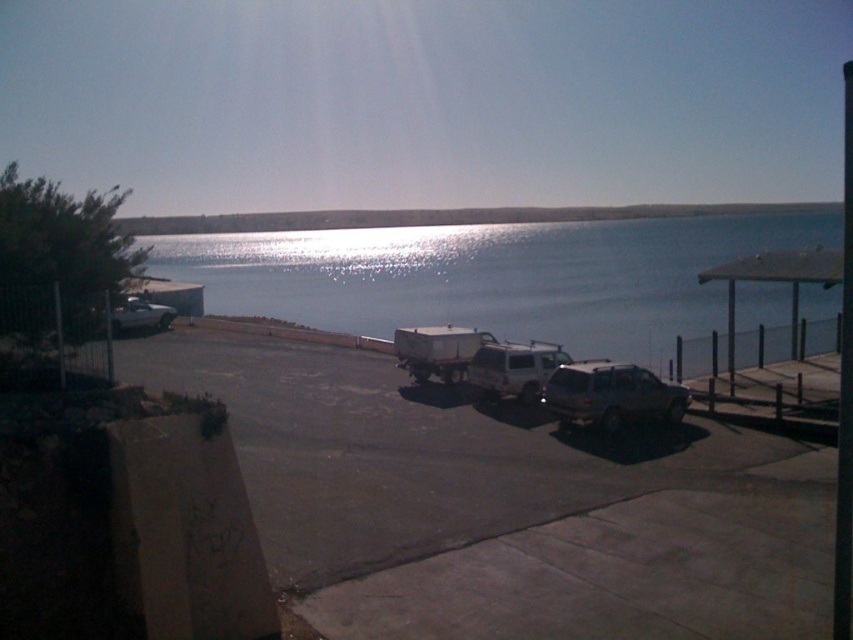
You are standing at the edge of the waterfront scene. You need to locate the dark gray asphalt parking lot at center. Based on the coordinates provided, in which direction should you look to find it?

You should look towards the center of the scene at point coordinates approximately 0.791 on the x axis and 0.589 on the y axis to find the dark gray asphalt parking lot at center.

You are a photographer planning to take a wide shot of the waterfront scene. The blue water at center and the satin silver suv at center are both in your frame. Which object will occupy more space in your photo?

The blue water at center will occupy more space in the photo because it is bigger than the satin silver suv at center according to the description.